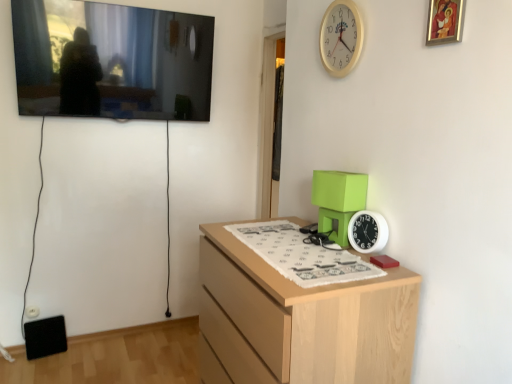
Where is `free space in front of white plastic clock at right, which is counted as the 1th clock, starting from the bottom`? free space in front of white plastic clock at right, which is counted as the 1th clock, starting from the bottom is located at coordinates (365, 266).